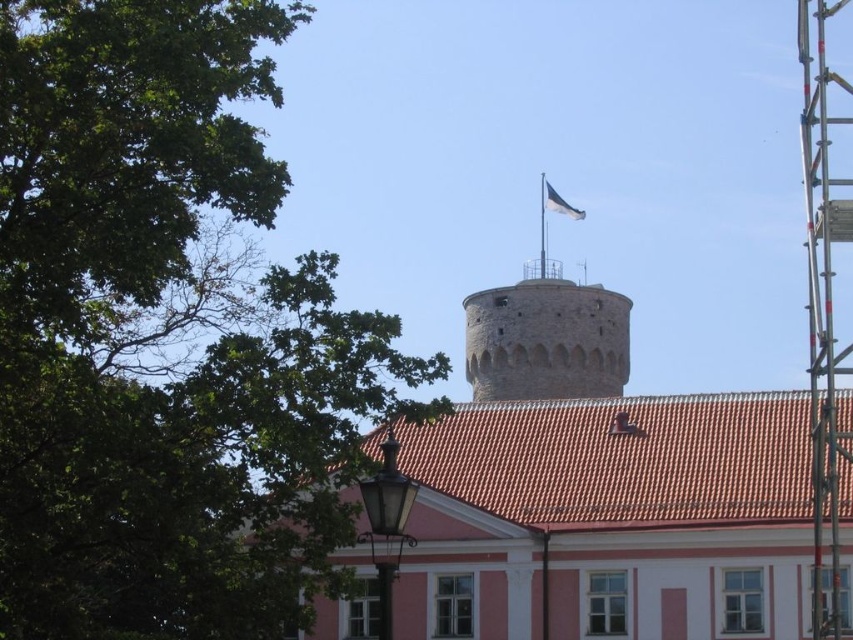
Question: Among these objects, which one is nearest to the camera?

Choices:
 (A) metallic ladder at upper right
 (B) brown stone tower at center
 (C) white plastic flag pole at upper center
 (D) green leafy tree at upper left

Answer: (D)

Question: Is brown stone tower at center positioned before metallic ladder at upper right?

Choices:
 (A) yes
 (B) no

Answer: (B)

Question: Is white fabric flag at upper center in front of white plastic flag pole at upper center?

Choices:
 (A) no
 (B) yes

Answer: (B)

Question: Which object appears farthest from the camera in this image?

Choices:
 (A) white fabric flag at upper center
 (B) white plastic flag pole at upper center

Answer: (B)

Question: Which point is closer to the camera?

Choices:
 (A) green leafy tree at upper left
 (B) metallic ladder at upper right
 (C) white plastic flag pole at upper center
 (D) brown stone tower at center

Answer: (A)

Question: Does green leafy tree at upper left appear on the left side of brown stone tower at center?

Choices:
 (A) yes
 (B) no

Answer: (A)